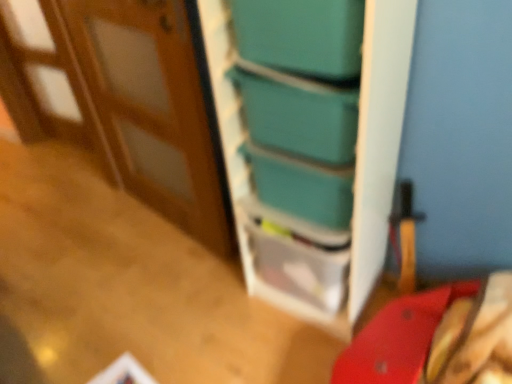
This screenshot has height=384, width=512. Find the location of `vacant space in front of wooden at left`. vacant space in front of wooden at left is located at coordinates (144, 314).